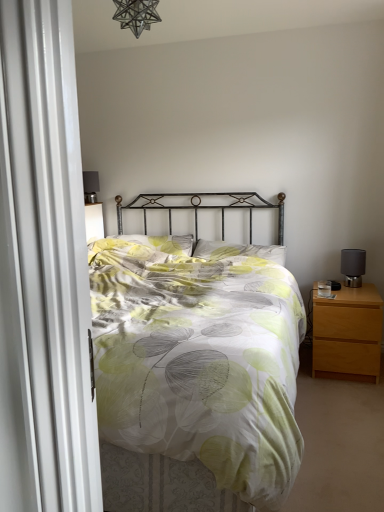
I want to click on matte black table lamp at right, so (353, 266).

What do you see at coordinates (348, 332) in the screenshot?
I see `light brown wood nightstand at right` at bounding box center [348, 332].

Image resolution: width=384 pixels, height=512 pixels. What are the coordinates of `white fabric pillow at center, acting as the 2th pillow starting from the left` in the screenshot? It's located at (239, 251).

Is light brown wood nightstand at right bigger or smaller than printed fabric bed at center?

Considering their sizes, light brown wood nightstand at right takes up less space than printed fabric bed at center.

From a real-world perspective, who is located lower, light brown wood nightstand at right or printed fabric bed at center?

In real-world perspective, light brown wood nightstand at right is lower.

Does point (327, 317) come closer to viewer compared to point (112, 320)?

No, it is behind (112, 320).

Which object is closer to the camera, light brown wood nightstand at right or printed fabric bed at center?

Result: printed fabric bed at center is in front.

Is point (123, 20) closer or farther from the camera than point (318, 301)?

Clearly, point (123, 20) is closer to the camera than point (318, 301).

Which of these two, metallic star-shaped light fixture at upper center or light brown wood nightstand at right, stands shorter?

Standing shorter between the two is metallic star-shaped light fixture at upper center.

From a real-world perspective, which is physically below, metallic star-shaped light fixture at upper center or light brown wood nightstand at right?

light brown wood nightstand at right.

Looking at this image, does metallic star-shaped light fixture at upper center come in front of light brown wood nightstand at right?

Yes, metallic star-shaped light fixture at upper center is closer to the viewer.

In the scene shown: Would you say printed fabric bed at center is to the left or to the right of light brown wood nightstand at right in the picture?

printed fabric bed at center is positioned on light brown wood nightstand at right's left side.

From a real-world perspective, who is located higher, printed fabric bed at center or light brown wood nightstand at right?

In real-world perspective, printed fabric bed at center is above.

From the image's perspective, which one is positioned lower, printed fabric bed at center or light brown wood nightstand at right?

From the image's view, light brown wood nightstand at right is below.

Do you think printed fabric bed at center is within light brown wood nightstand at right, or outside of it?

printed fabric bed at center is not enclosed by light brown wood nightstand at right.

Which object is thinner, metallic star-shaped light fixture at upper center or matte black table lamp at right?

matte black table lamp at right is thinner.

Would you say metallic star-shaped light fixture at upper center contains matte black table lamp at right?

No, matte black table lamp at right is not surrounded by metallic star-shaped light fixture at upper center.

Is metallic star-shaped light fixture at upper center bigger or smaller than matte black table lamp at right?

In the image, metallic star-shaped light fixture at upper center appears to be larger than matte black table lamp at right.

From a real-world perspective, is matte black table lamp at right below light green fabric pillow at center, the first pillow when ordered from left to right?

Correct, in the physical world, matte black table lamp at right is lower than light green fabric pillow at center, the first pillow when ordered from left to right.

Is matte black table lamp at right to the left of light green fabric pillow at center, the first pillow when ordered from left to right, from the viewer's perspective?

In fact, matte black table lamp at right is to the right of light green fabric pillow at center, the first pillow when ordered from left to right.

Looking at this image, can you tell me how much matte black table lamp at right and light green fabric pillow at center, which is counted as the 2th pillow, starting from the right, differ in facing direction?

The facing directions of matte black table lamp at right and light green fabric pillow at center, which is counted as the 2th pillow, starting from the right, are 1.69 degrees apart.

Is point (359, 261) farther from viewer compared to point (142, 243)?

No, it is in front of (142, 243).

Is printed fabric bed at center turned away from light green fabric pillow at center, which is counted as the 2th pillow, starting from the right?

Yes.

Does printed fabric bed at center have a greater width compared to light green fabric pillow at center, the first pillow when ordered from left to right?

Yes.

Does point (106, 295) come farther from viewer compared to point (184, 234)?

No, (106, 295) is closer to viewer.

Can you confirm if matte black table lamp at right is positioned to the left of light brown wood nightstand at right?

No, matte black table lamp at right is not to the left of light brown wood nightstand at right.

Considering their positions, is matte black table lamp at right located in front of or behind light brown wood nightstand at right?

matte black table lamp at right is positioned farther from the viewer than light brown wood nightstand at right.

Is matte black table lamp at right positioned far away from light brown wood nightstand at right?

They are positioned close to each other.

At what (x,y) coordinates should I click in order to perform the action: click on nightstand behind the printed fabric bed at center. Please return your answer as a coordinate pair (x, y). Looking at the image, I should click on (348, 332).

Image resolution: width=384 pixels, height=512 pixels. Identify the location of light fixture that is above the light brown wood nightstand at right (from the image's perspective). (136, 15).

When comparing their distances from white fabric pillow at center, which is the first pillow from right to left, does light brown wood nightstand at right or light green fabric pillow at center, which is counted as the 2th pillow, starting from the right, seem further?

light brown wood nightstand at right.

Estimate the real-world distances between objects in this image. Which object is further from light brown wood nightstand at right, matte black table lamp at right or white fabric pillow at center, which is the first pillow from right to left?

white fabric pillow at center, which is the first pillow from right to left, lies further to light brown wood nightstand at right than the other object.

When comparing their distances from printed fabric bed at center, does light green fabric pillow at center, which is counted as the 2th pillow, starting from the right, or white fabric pillow at center, which is the first pillow from right to left, seem further?

Among the two, light green fabric pillow at center, which is counted as the 2th pillow, starting from the right, is located further to printed fabric bed at center.

When comparing their distances from printed fabric bed at center, does metallic star-shaped light fixture at upper center or light green fabric pillow at center, the first pillow when ordered from left to right, seem closer?

light green fabric pillow at center, the first pillow when ordered from left to right.

Which object lies further to the anchor point white fabric pillow at center, which is the first pillow from right to left, printed fabric bed at center or metallic star-shaped light fixture at upper center?

Based on the image, metallic star-shaped light fixture at upper center appears to be further to white fabric pillow at center, which is the first pillow from right to left.

From the image, which object appears to be nearer to light brown wood nightstand at right, white fabric pillow at center, acting as the 2th pillow starting from the left, or matte black table lamp at right?

The object closer to light brown wood nightstand at right is matte black table lamp at right.

Which object lies further to the anchor point light green fabric pillow at center, the first pillow when ordered from left to right, metallic star-shaped light fixture at upper center or printed fabric bed at center?

metallic star-shaped light fixture at upper center lies further to light green fabric pillow at center, the first pillow when ordered from left to right, than the other object.

Estimate the real-world distances between objects in this image. Which object is closer to light brown wood nightstand at right, white fabric pillow at center, which is the first pillow from right to left, or printed fabric bed at center?

white fabric pillow at center, which is the first pillow from right to left.

At what (x,y) coordinates should I click in order to perform the action: click on light fixture between printed fabric bed at center and matte black table lamp at right in the front-back direction. Please return your answer as a coordinate pair (x, y). Looking at the image, I should click on (136, 15).

You are a GUI agent. You are given a task and a screenshot of the screen. Output one action in this format:
    pyautogui.click(x=<x>, y=<y>)
    Task: Click on the nightstand situated between light green fabric pillow at center, the first pillow when ordered from left to right, and matte black table lamp at right from left to right
    The image size is (384, 512).
    Given the screenshot: What is the action you would take?
    pyautogui.click(x=348, y=332)

Locate an element on the screen. The image size is (384, 512). pillow that lies between metallic star-shaped light fixture at upper center and white fabric pillow at center, acting as the 2th pillow starting from the left, from top to bottom is located at coordinates (163, 243).

The width and height of the screenshot is (384, 512). What are the coordinates of `pillow positioned between printed fabric bed at center and light green fabric pillow at center, the first pillow when ordered from left to right, from near to far` in the screenshot? It's located at (239, 251).